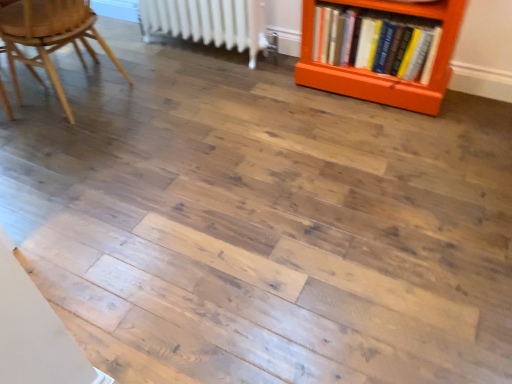
Locate an element on the screen. The width and height of the screenshot is (512, 384). free space in front of wooden chair at left is located at coordinates (88, 170).